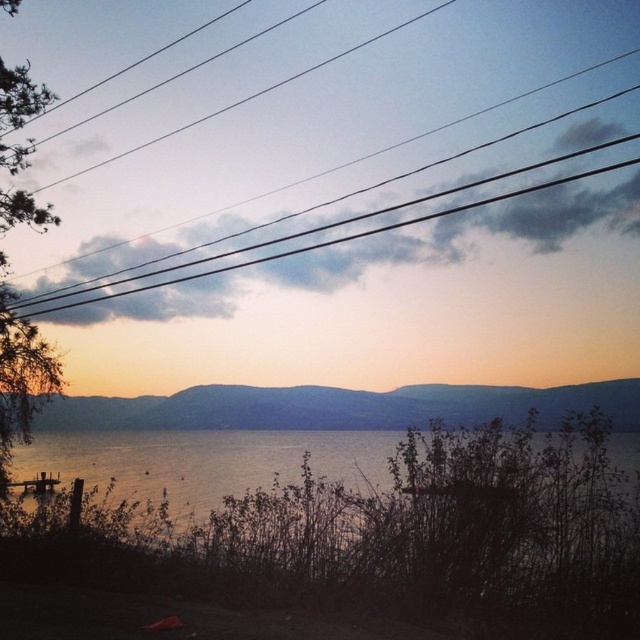
Question: From the image, what is the correct spatial relationship of silvery reflective water at lower center in relation to black wire at upper center?

Choices:
 (A) above
 (B) below

Answer: (B)

Question: Which object appears farthest from the camera in this image?

Choices:
 (A) silvery reflective water at lower center
 (B) black wire at upper center

Answer: (B)

Question: Is silvery reflective water at lower center wider than black wire at upper center?

Choices:
 (A) yes
 (B) no

Answer: (B)

Question: Is silvery reflective water at lower center smaller than black wire at upper center?

Choices:
 (A) yes
 (B) no

Answer: (A)

Question: Which point appears closest to the camera in this image?

Choices:
 (A) (620, 436)
 (B) (243, 99)

Answer: (A)